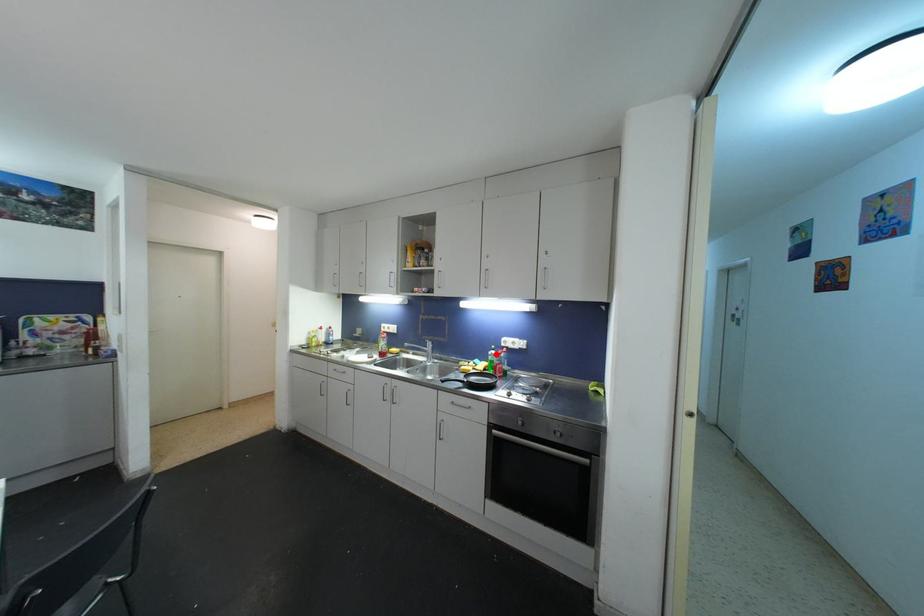
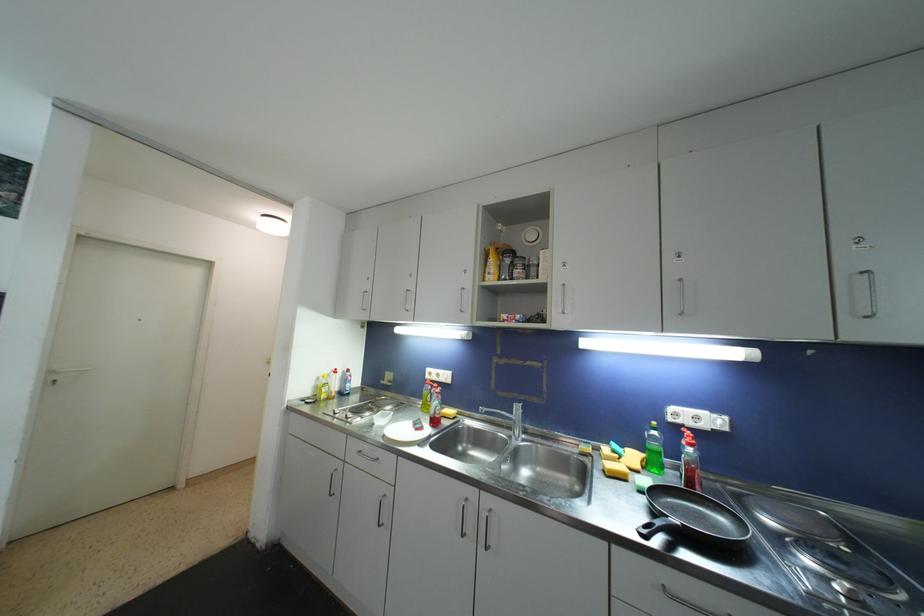
In the second image, find the point that corresponds to the highlighted location in the first image.

(658, 436)